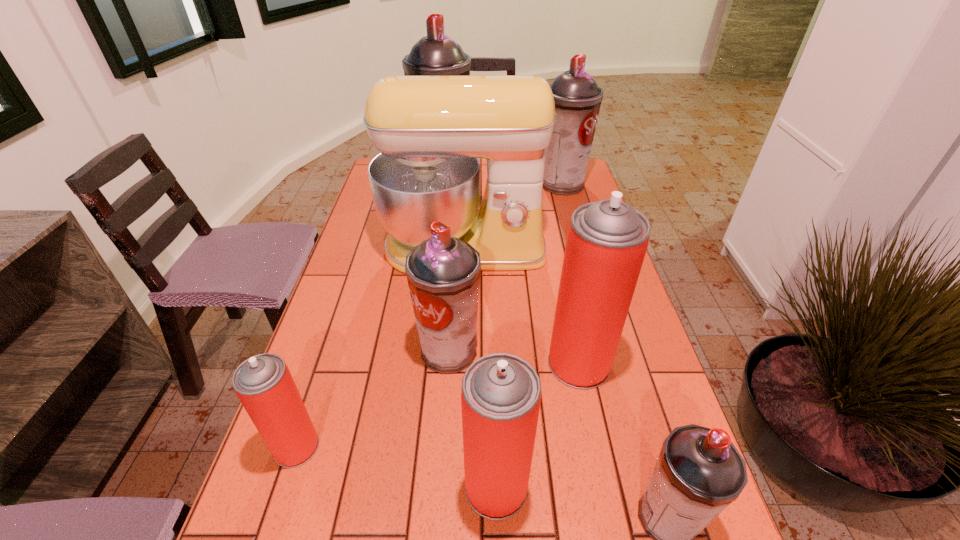
At what (x,y) coordinates should I click in order to perform the action: click on the tallest aerosol can. Please return your answer as a coordinate pair (x, y). Looking at the image, I should click on (436, 54).

Find the location of a particular element. The height and width of the screenshot is (540, 960). the sixth nearest object is located at coordinates (430, 131).

Find the location of a particular element. the third smallest gray aerosol can is located at coordinates (577, 97).

The height and width of the screenshot is (540, 960). What are the coordinates of `the farthest red aerosol can` in the screenshot? It's located at (607, 240).

Identify the location of the biggest red aerosol can. This screenshot has width=960, height=540. (607, 240).

Locate an element on the screen. The image size is (960, 540). the third biggest gray aerosol can is located at coordinates (443, 272).

This screenshot has width=960, height=540. I want to click on the second red aerosol can from left to right, so click(501, 393).

Where is `the leftmost aerosol can`? The width and height of the screenshot is (960, 540). the leftmost aerosol can is located at coordinates (263, 383).

Where is `the smallest red aerosol can`? the smallest red aerosol can is located at coordinates (263, 383).

Locate an element on the screen. vacant space located 0.060m on the left of the biggest gray aerosol can is located at coordinates point(399,172).